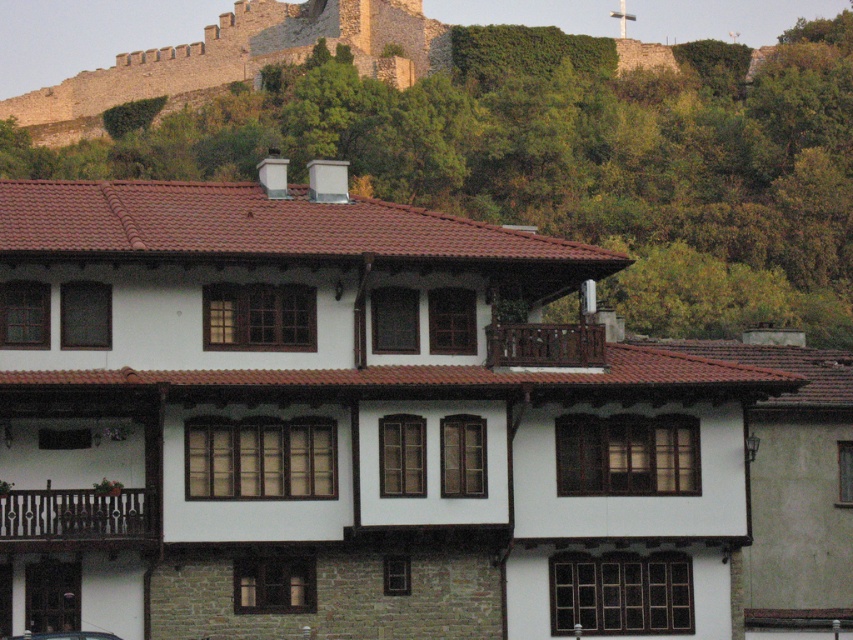
Question: Does brown stone wall at upper center come in front of metallic silver car at lower left?

Choices:
 (A) yes
 (B) no

Answer: (B)

Question: Can you confirm if brown stone wall at upper center is positioned below metallic silver car at lower left?

Choices:
 (A) yes
 (B) no

Answer: (B)

Question: Does brown stone wall at upper center appear over metallic silver car at lower left?

Choices:
 (A) yes
 (B) no

Answer: (A)

Question: Which point is farther from the camera taking this photo?

Choices:
 (A) (102, 634)
 (B) (392, 70)

Answer: (B)

Question: Which of the following is the farthest from the observer?

Choices:
 (A) metallic silver car at lower left
 (B) brown stone wall at upper center

Answer: (B)

Question: Which of the following is the farthest from the observer?

Choices:
 (A) (318, 4)
 (B) (64, 634)

Answer: (A)